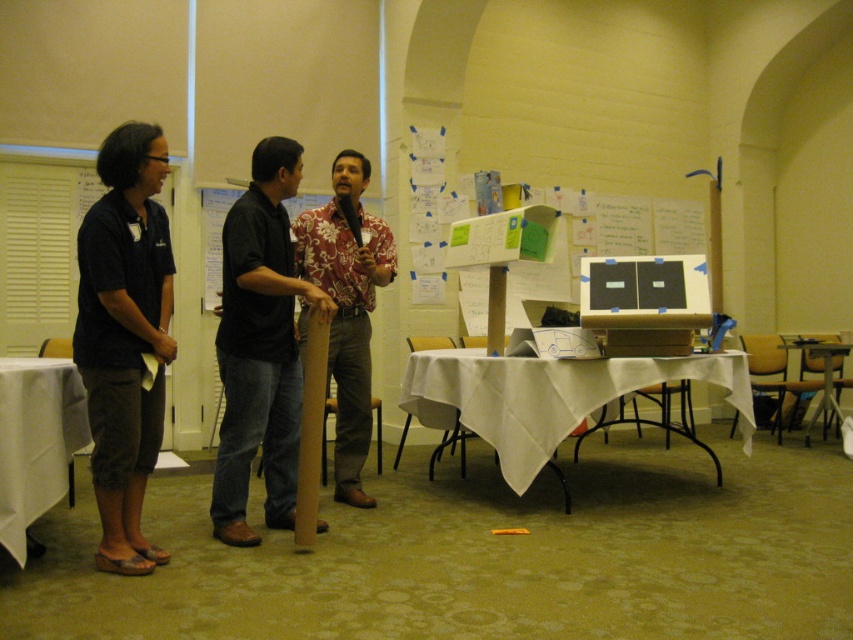
Between white cloth-covered table at center and white cloth table at left, which one appears on the left side from the viewer's perspective?

white cloth table at left is more to the left.

Does white cloth-covered table at center appear on the left side of white cloth table at left?

No, white cloth-covered table at center is not to the left of white cloth table at left.

Which is behind, point (512, 404) or point (33, 358)?

The point (512, 404) is more distant.

Find the location of a particular element. The image size is (853, 640). white cloth-covered table at center is located at coordinates (548, 396).

Measure the distance between point [102,179] and camera.

The distance of point [102,179] from camera is 2.77 meters.

Which is behind, point (158, 548) or point (85, 412)?

The point (85, 412) is more distant.

Between point (96, 480) and point (32, 500), which one is positioned in front?

Point (32, 500) is more forward.

Find the location of a particular element. The image size is (853, 640). dark blue shirt at left is located at coordinates (125, 337).

Between dark blue shirt at left and white cloth-covered table at center, which one has less height?

white cloth-covered table at center

Is point (157, 294) behind point (577, 396)?

That is False.

Between point (113, 348) and point (563, 387), which one is positioned in front?

Point (113, 348) is in front.

I want to click on dark blue shirt at left, so click(x=125, y=337).